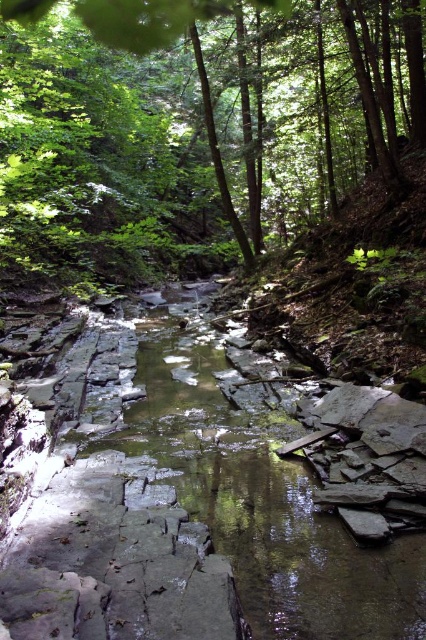
Which is above, green leafy tree at upper center or gray stone stream at center?

green leafy tree at upper center

Which is in front, point (37, 132) or point (215, 518)?

Positioned in front is point (215, 518).

Locate an element on the screen. This screenshot has height=640, width=426. green leafy tree at upper center is located at coordinates (193, 125).